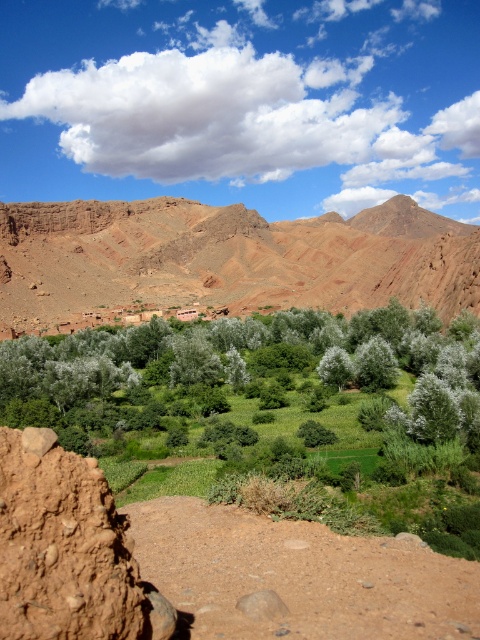
You are standing at the coordinates 0.5, 0.5 in the image. Which direction should you move to reach the brown rocky mountain at center?

Since the brown rocky mountain at center is located at point (x=225, y=259), which is slightly to the left and below your current position at (x=240, y=320), you should move to the left and downward to reach it.

You are an explorer standing on the dirt path in the foreground of the scene. You want to reach the green leafy trees at center to collect samples. However, there is a brown rocky mountain at center blocking your path. Can you walk around the mountain to reach the trees?

The green leafy trees at center are behind the brown rocky mountain at center, so you can walk around the mountain to reach the trees since they are located behind it.

From the picture: You are a hiker standing at the base of the brown rocky mountain at center and want to reach the green leafy trees at center. Which direction should you move to get there?

The brown rocky mountain at center is to the right of the green leafy trees at center, so you should move to the left to reach them.